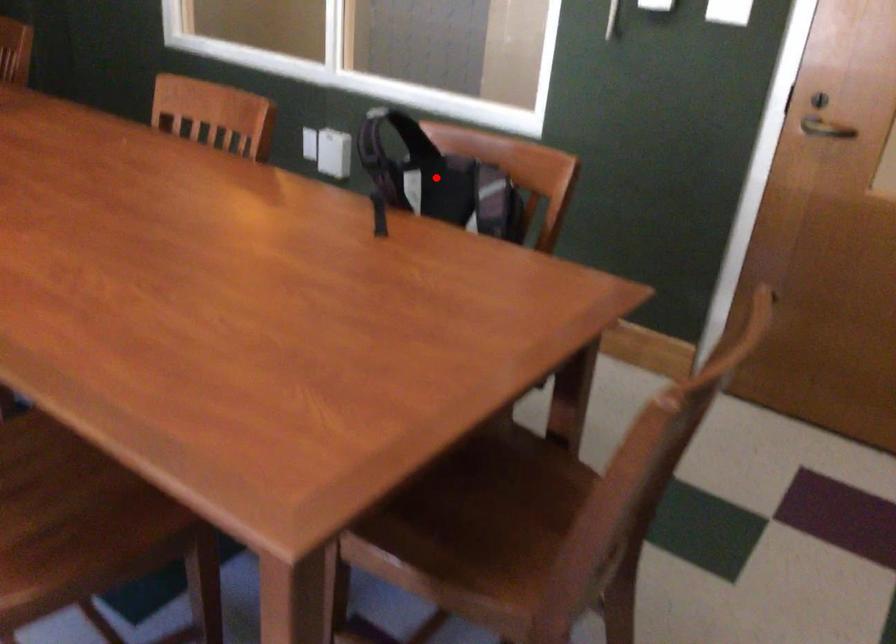
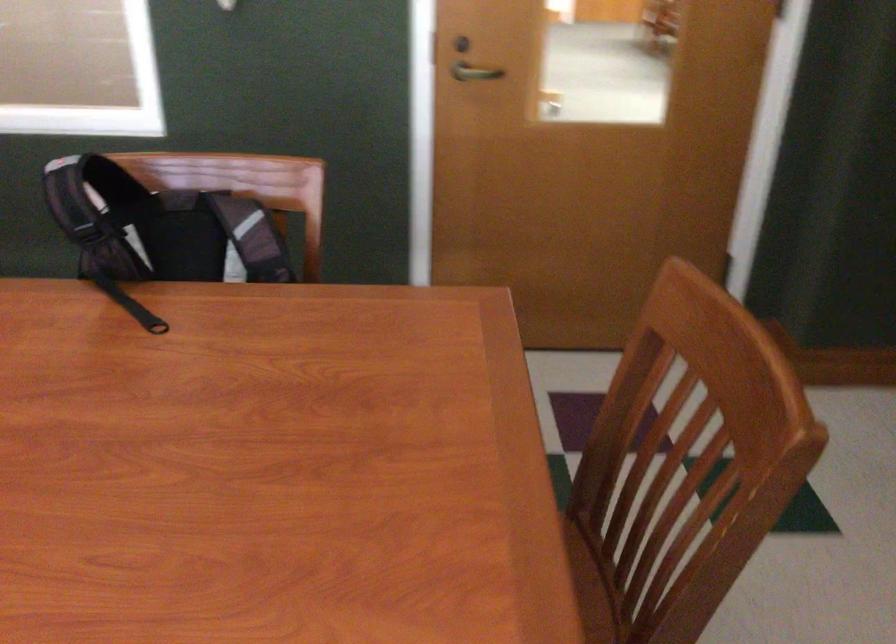
Where in the second image is the point corresponding to the highlighted location from the first image?

(159, 228)